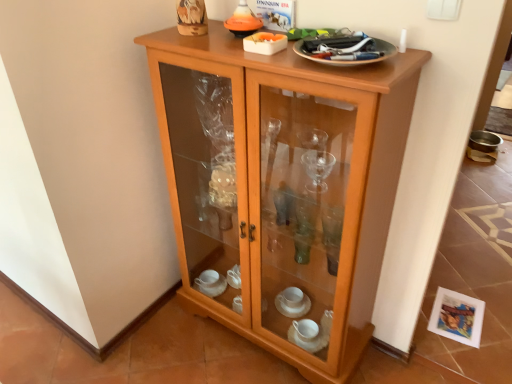
Image resolution: width=512 pixels, height=384 pixels. Describe the element at coordinates (349, 60) in the screenshot. I see `metallic silver plate at upper right` at that location.

Where is `metallic silver plate at upper right`? This screenshot has height=384, width=512. metallic silver plate at upper right is located at coordinates (349, 60).

The height and width of the screenshot is (384, 512). What do you see at coordinates (282, 185) in the screenshot? I see `light wood/glass cupboard at center` at bounding box center [282, 185].

In order to face light wood/glass cupboard at center, should I rotate leftwards or rightwards?

You should look right and rotate roughly 2.330 degrees.

This screenshot has height=384, width=512. What are the coordinates of `light wood/glass cupboard at center` in the screenshot? It's located at (282, 185).

The height and width of the screenshot is (384, 512). I want to click on metallic silver plate at upper right, so click(349, 60).

Considering the relative positions of metallic silver plate at upper right and light wood/glass cupboard at center in the image provided, is metallic silver plate at upper right to the left of light wood/glass cupboard at center from the viewer's perspective?

No.

Consider the image. Is metallic silver plate at upper right behind light wood/glass cupboard at center?

Yes, metallic silver plate at upper right is further from the camera.

Which is closer, (297, 50) or (415, 93)?

Point (297, 50)

From the image's perspective, is metallic silver plate at upper right above light wood/glass cupboard at center?

Yes, from the image's perspective, metallic silver plate at upper right is over light wood/glass cupboard at center.

From a real-world perspective, is metallic silver plate at upper right physically located above or below light wood/glass cupboard at center?

In terms of real-world spatial position, metallic silver plate at upper right is above light wood/glass cupboard at center.

Considering the sizes of metallic silver plate at upper right and light wood/glass cupboard at center in the image, is metallic silver plate at upper right wider or thinner than light wood/glass cupboard at center?

Considering their sizes, metallic silver plate at upper right looks slimmer than light wood/glass cupboard at center.

Considering the sizes of objects metallic silver plate at upper right and light wood/glass cupboard at center in the image provided, who is taller, metallic silver plate at upper right or light wood/glass cupboard at center?

light wood/glass cupboard at center.

Can you confirm if metallic silver plate at upper right is smaller than light wood/glass cupboard at center?

Yes, metallic silver plate at upper right is smaller than light wood/glass cupboard at center.

Is metallic silver plate at upper right not within light wood/glass cupboard at center?

That's correct, metallic silver plate at upper right is outside of light wood/glass cupboard at center.

From the picture: Are metallic silver plate at upper right and light wood/glass cupboard at center making contact?

metallic silver plate at upper right is not next to light wood/glass cupboard at center, and they're not touching.

Is metallic silver plate at upper right turned away from light wood/glass cupboard at center?

No, metallic silver plate at upper right is not facing the opposite direction of light wood/glass cupboard at center.

Locate an element on the screen. The width and height of the screenshot is (512, 384). cupboard below the metallic silver plate at upper right (from the image's perspective) is located at coordinates pyautogui.click(x=282, y=185).

Is light wood/glass cupboard at center at the right side of metallic silver plate at upper right?

In fact, light wood/glass cupboard at center is to the left of metallic silver plate at upper right.

Is light wood/glass cupboard at center in front of metallic silver plate at upper right?

Yes, light wood/glass cupboard at center is in front of metallic silver plate at upper right.

Which is more distant, (x=250, y=206) or (x=386, y=46)?

The point (x=250, y=206) is more distant.

From the image's perspective, is light wood/glass cupboard at center located above metallic silver plate at upper right?

No, from the image's perspective, light wood/glass cupboard at center is not over metallic silver plate at upper right.

From a real-world perspective, which object rests below the other?

light wood/glass cupboard at center.

Between light wood/glass cupboard at center and metallic silver plate at upper right, which one has larger width?

With larger width is light wood/glass cupboard at center.

Between light wood/glass cupboard at center and metallic silver plate at upper right, which one has less height?

With less height is metallic silver plate at upper right.

Does light wood/glass cupboard at center have a smaller size compared to metallic silver plate at upper right?

Actually, light wood/glass cupboard at center might be larger than metallic silver plate at upper right.

Looking at this image, is light wood/glass cupboard at center spatially inside metallic silver plate at upper right, or outside of it?

light wood/glass cupboard at center exists outside the volume of metallic silver plate at upper right.

Would you consider light wood/glass cupboard at center to be distant from metallic silver plate at upper right?

light wood/glass cupboard at center is near metallic silver plate at upper right, not far away.

Consider the image. Is light wood/glass cupboard at center aimed at metallic silver plate at upper right?

No, light wood/glass cupboard at center is not facing towards metallic silver plate at upper right.

How different are the orientations of light wood/glass cupboard at center and metallic silver plate at upper right in degrees?

They differ by 9.09e-05 degrees in their facing directions.

Locate an element on the screen. cupboard in front of the metallic silver plate at upper right is located at coordinates (282, 185).

I want to click on cupboard below the metallic silver plate at upper right (from a real-world perspective), so click(x=282, y=185).

I want to click on tableware that is on the right side of light wood/glass cupboard at center, so pyautogui.click(x=349, y=60).